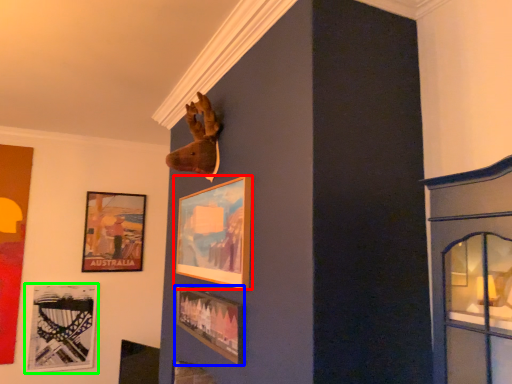
Question: Estimate the real-world distances between objects in this image. Which object is closer to picture frame (highlighted by a red box), picture frame (highlighted by a blue box) or picture frame (highlighted by a green box)?

Choices:
 (A) picture frame
 (B) picture frame

Answer: (A)